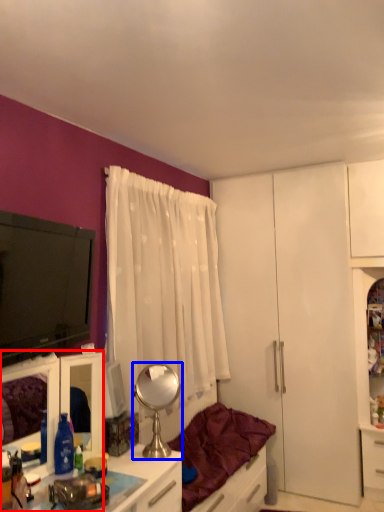
Question: Which object is further to the camera taking this photo, cabinetry (highlighted by a red box) or mirror (highlighted by a blue box)?

Choices:
 (A) cabinetry
 (B) mirror

Answer: (B)